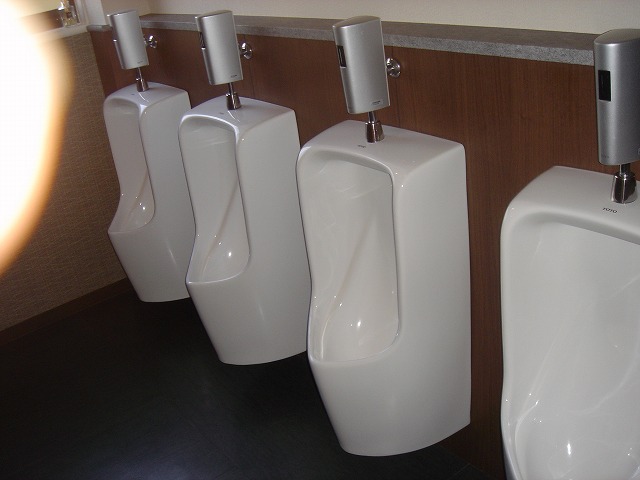
Where is `urinals`? This screenshot has width=640, height=480. urinals is located at coordinates (138, 179), (221, 192), (348, 213), (575, 294).